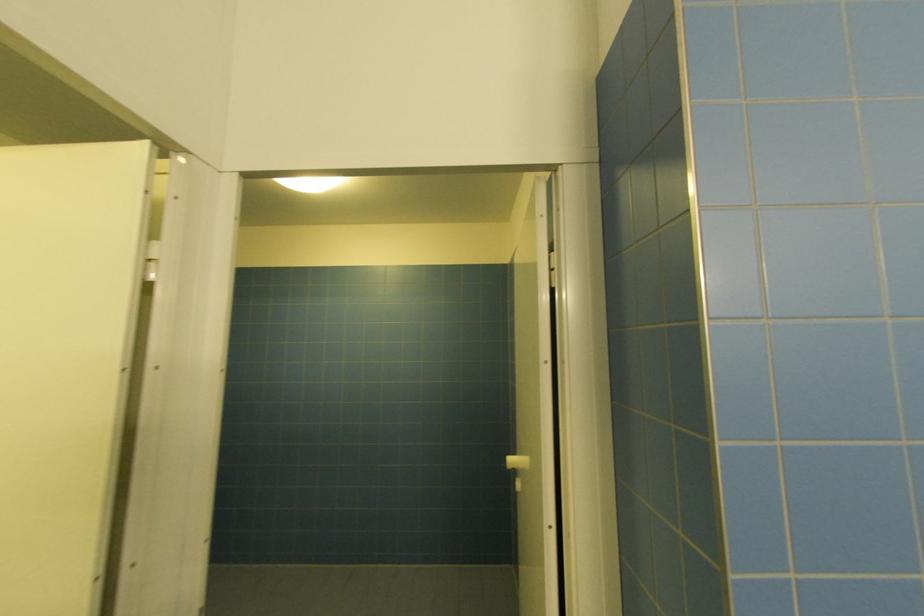
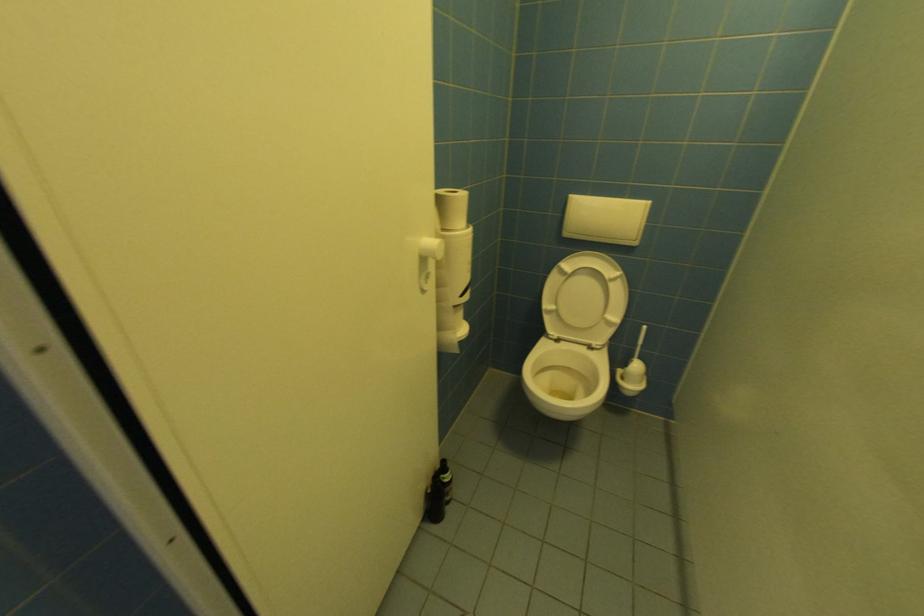
Based on the continuous images, in which direction is the camera rotating?

The camera's rotation is toward left-down.